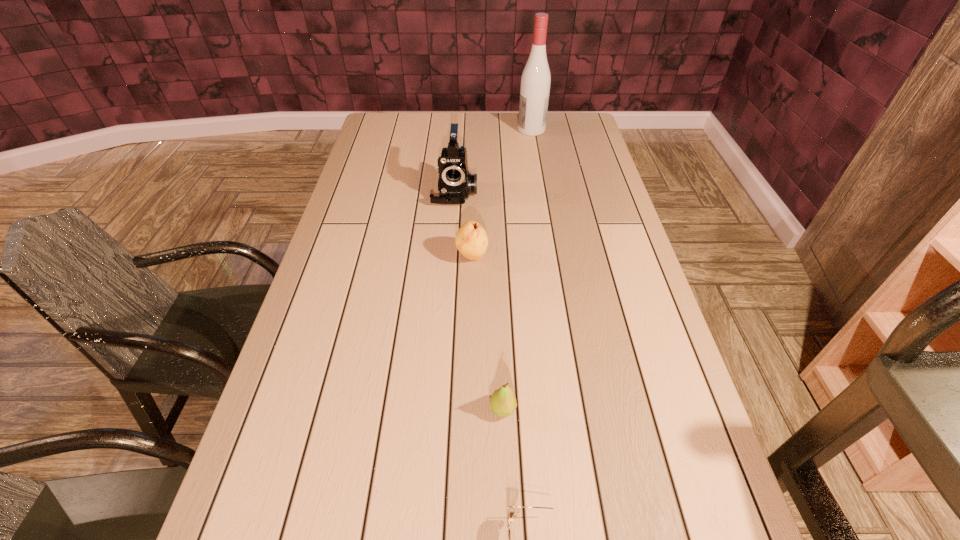
Image resolution: width=960 pixels, height=540 pixels. What are the coordinates of `alcohol` in the screenshot? It's located at (535, 82).

The width and height of the screenshot is (960, 540). Identify the location of the tallest object. (535, 82).

Where is `the fourth shortest object`? the fourth shortest object is located at coordinates (455, 184).

Locate an element on the screen. This screenshot has width=960, height=540. the fourth nearest object is located at coordinates (455, 184).

Identify the location of the third nearest object. The width and height of the screenshot is (960, 540). (471, 240).

Identify the location of the shorter pear. The width and height of the screenshot is (960, 540). (503, 402).

In order to click on the nearer pear in this screenshot , I will do `click(503, 402)`.

Image resolution: width=960 pixels, height=540 pixels. What are the coordinates of `free space located on the label of the tallest object` in the screenshot? It's located at (495, 130).

I want to click on vacant space located on the label of the tallest object, so click(488, 130).

Where is `free space located on the label of the tallest object`? free space located on the label of the tallest object is located at coordinates (502, 130).